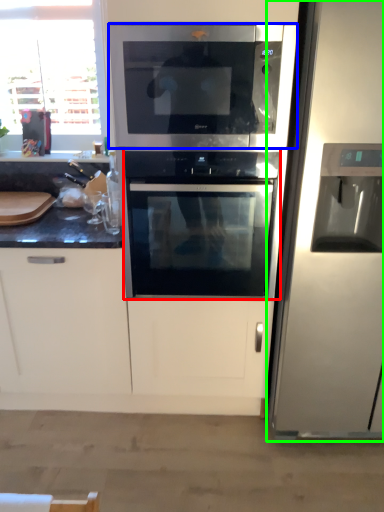
Question: Considering the real-world distances, which object is closest to oven (highlighted by a red box)? microwave oven (highlighted by a blue box) or refrigerator (highlighted by a green box).

Choices:
 (A) microwave oven
 (B) refrigerator

Answer: (A)